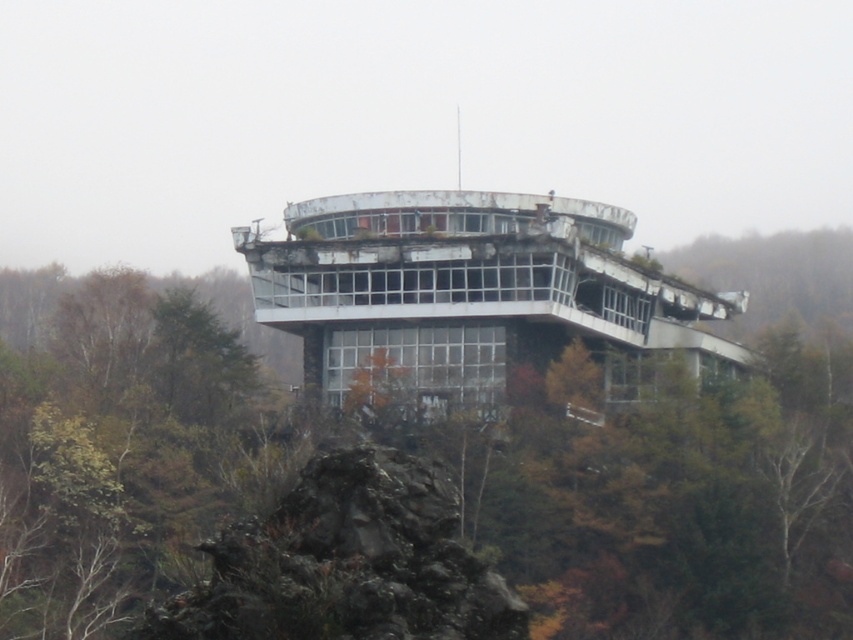
Between green leafy tree at center and dark gray rough rock at center, which one appears on the right side from the viewer's perspective?

green leafy tree at center

Between green leafy tree at center and dark gray rough rock at center, which one has more height?

green leafy tree at center is taller.

Locate an element on the screen. The height and width of the screenshot is (640, 853). green leafy tree at center is located at coordinates (422, 452).